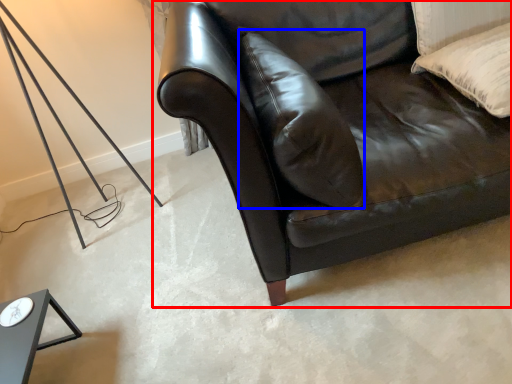
Question: Which object is further to the camera taking this photo, studio couch (highlighted by a red box) or pillow (highlighted by a blue box)?

Choices:
 (A) studio couch
 (B) pillow

Answer: (B)